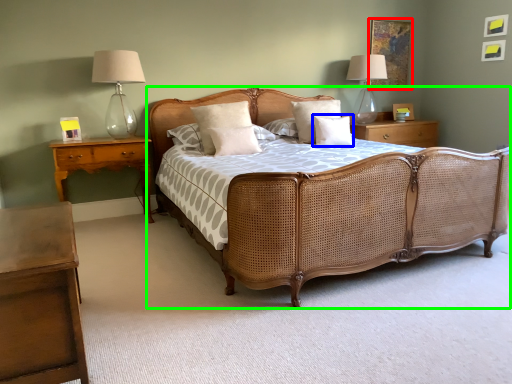
Question: Which object is positioned farthest from picture frame (highlighted by a red box)? Select from pillow (highlighted by a blue box) and bed (highlighted by a green box).

Choices:
 (A) pillow
 (B) bed

Answer: (B)